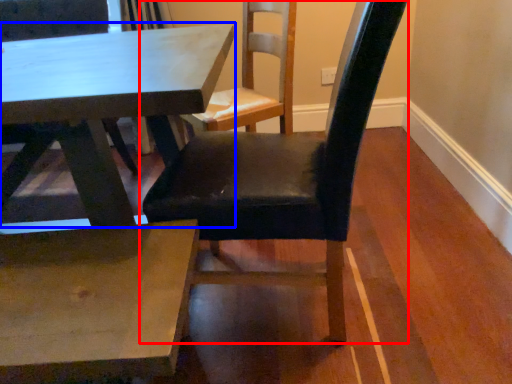
Question: Which of the following is the closest to the observer, chair (highlighted by a red box) or table (highlighted by a blue box)?

Choices:
 (A) chair
 (B) table

Answer: (A)